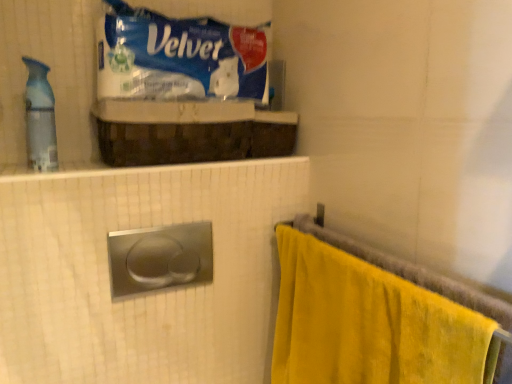
Question: Does point (315, 253) appear closer or farther from the camera than point (226, 31)?

Choices:
 (A) closer
 (B) farther

Answer: (A)

Question: Considering the positions of yellow velour towel at right and blue plastic velver at upper center in the image, is yellow velour towel at right bigger or smaller than blue plastic velver at upper center?

Choices:
 (A) small
 (B) big

Answer: (B)

Question: Considering the real-world distances, which object is farthest from the yellow velour towel at right?

Choices:
 (A) blue plastic velver at upper center
 (B) translucent plastic spray bottle at left

Answer: (B)

Question: Considering the real-world distances, which object is closest to the yellow velour towel at right?

Choices:
 (A) translucent plastic spray bottle at left
 (B) blue plastic velver at upper center

Answer: (B)